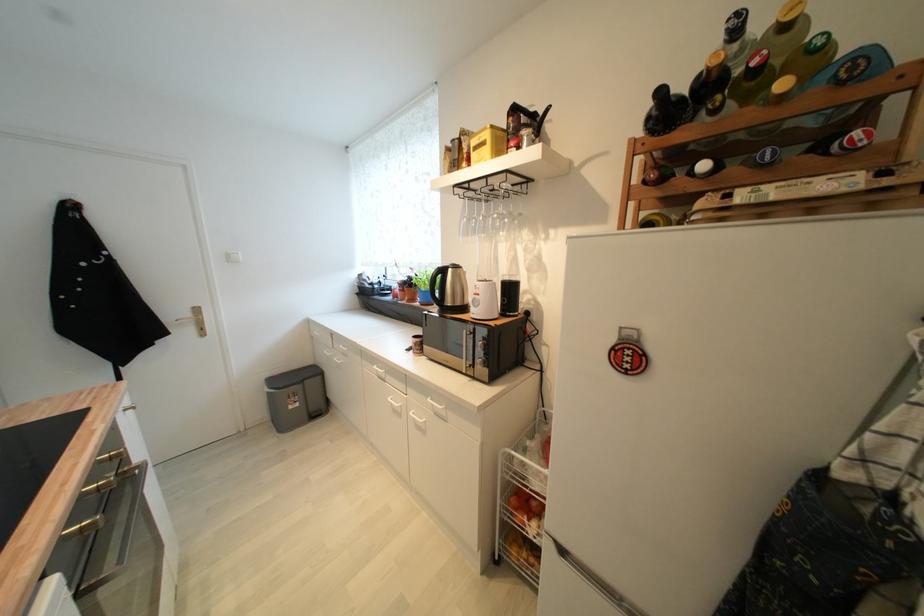
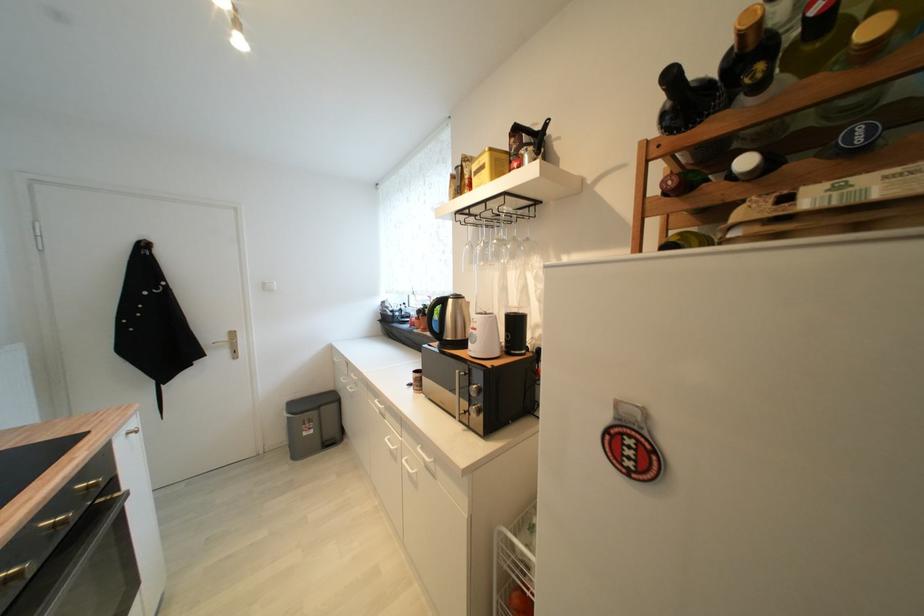
Where in the second image is the point corresponding to (516,291) from the first image?

(521, 325)